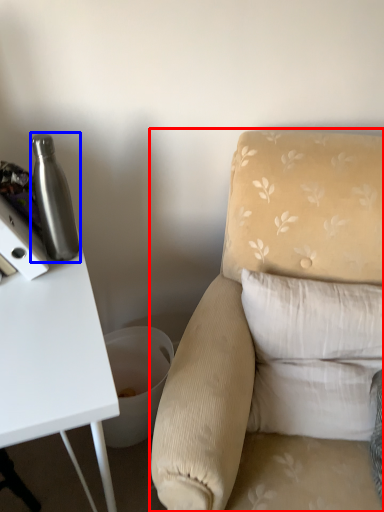
Question: Which of the following is the farthest to the observer, chair (highlighted by a red box) or bottle (highlighted by a blue box)?

Choices:
 (A) chair
 (B) bottle

Answer: (B)